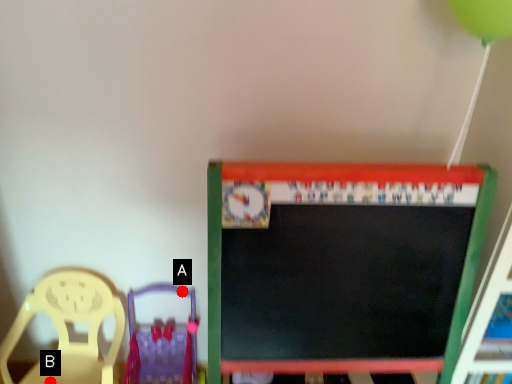
Question: Two points are circled on the image, labeled by A and B beside each circle. Which point is farther to the camera?

Choices:
 (A) A is further
 (B) B is further

Answer: (A)